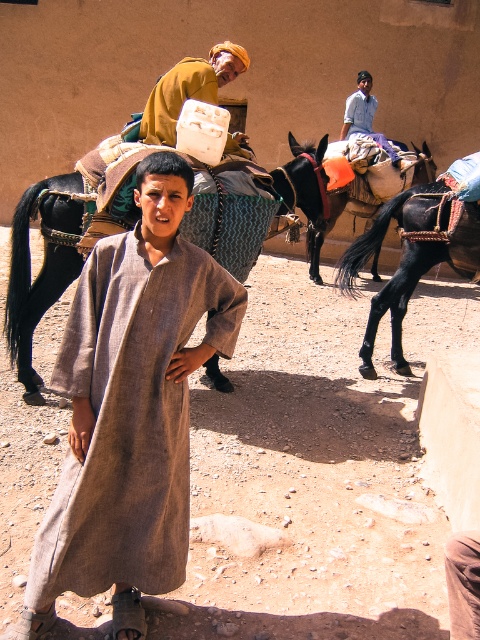
Based on the scene description, where is the black glossy donkey at right located in the image?

The black glossy donkey at right is located at the 2D coordinates point (410, 257) in the image.

You are a traveler who needs to secure your saddle on the horse. Based on the scene, is the black leather saddle at right currently positioned above or below the black leather horse at left?

The black leather horse at left is located below the black leather saddle at right, so the saddle is positioned above the horse.

You are a traveler standing at the center of the scene and want to approach the black glossy donkey at right and the yellow fabric turban at upper center. Which one is closer to you?

The black glossy donkey at right is closer to you than the yellow fabric turban at upper center because they are 5.24 feet apart from each other.